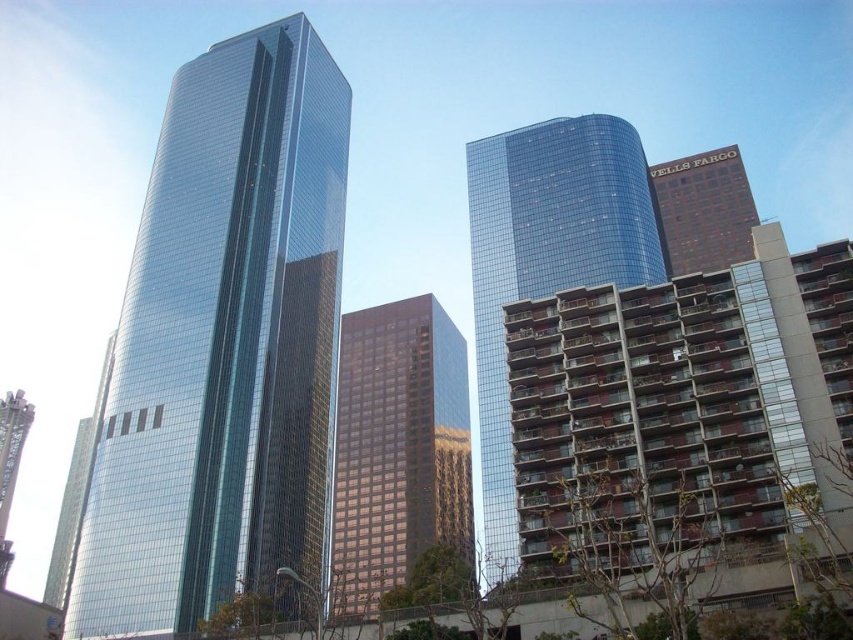
Is brown glass building at center to the right of brick textured building at upper right from the viewer's perspective?

Incorrect, brown glass building at center is not on the right side of brick textured building at upper right.

How distant is brown glass building at center from brick textured building at upper right?

brown glass building at center is 57.17 meters from brick textured building at upper right.

At what (x,y) coordinates should I click in order to perform the action: click on brown glass building at center. Please return your answer as a coordinate pair (x, y). Looking at the image, I should click on (398, 449).

The width and height of the screenshot is (853, 640). Identify the location of brown glass building at center. (398, 449).

Which of these two, glossy glass skyscraper at center or brick textured building at upper right, stands shorter?

Standing shorter between the two is brick textured building at upper right.

Is glossy glass skyscraper at center closer to camera compared to brick textured building at upper right?

Yes, it is.

Is point (305, 548) in front of point (666, 260)?

Yes.

The image size is (853, 640). Identify the location of glossy glass skyscraper at center. (223, 344).

What do you see at coordinates (544, 262) in the screenshot? I see `glossy glass building at center` at bounding box center [544, 262].

Is glossy glass building at center positioned at the back of brick textured building at upper right?

No.

Identify the location of glossy glass building at center. (544, 262).